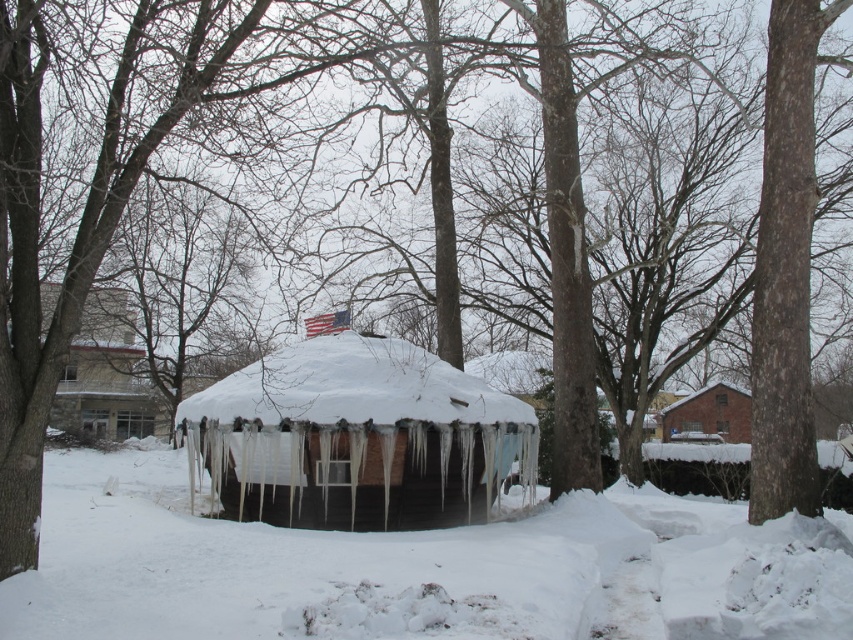
Question: Observing the image, what is the correct spatial positioning of white frosty snow at center in reference to white wooden hut at center?

Choices:
 (A) below
 (B) above

Answer: (A)

Question: Can you confirm if white wooden hut at center is positioned above brick house at right?

Choices:
 (A) no
 (B) yes

Answer: (A)

Question: Does white frosty snow at center appear on the left side of brick house at right?

Choices:
 (A) no
 (B) yes

Answer: (B)

Question: Which point is farther to the camera?

Choices:
 (A) (508, 413)
 (B) (566, 531)
 (C) (724, 408)

Answer: (C)

Question: Which object is positioned closest to the white frosty snow at center?

Choices:
 (A) white wooden hut at center
 (B) brick house at right

Answer: (A)

Question: Which object appears farthest from the camera in this image?

Choices:
 (A) white wooden hut at center
 (B) brick house at right
 (C) white frosty snow at center

Answer: (A)